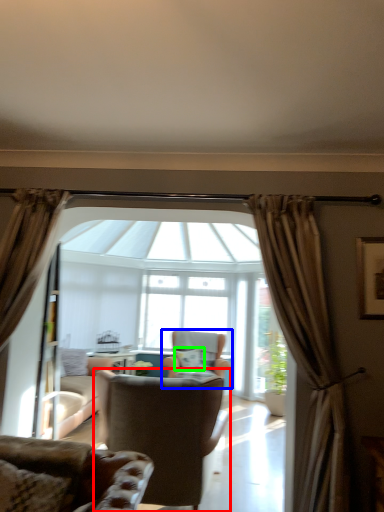
Question: Which is nearer to the chair (highlighted by a red box)? chair (highlighted by a blue box) or pillow (highlighted by a green box).

Choices:
 (A) chair
 (B) pillow

Answer: (B)